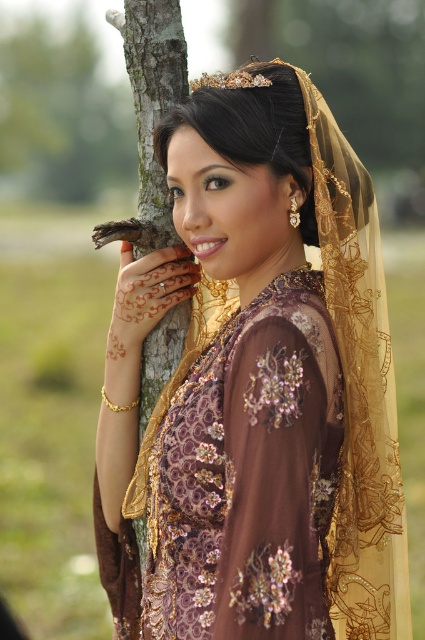
You are a photographer who wants to ensure that both the brown embroidered dress at center and the matte gold headscarf at upper center are clearly visible in your photo. Given their sizes, which object might require you to adjust your camera focus more carefully to ensure it doesn not get lost in the background blur?

The matte gold headscarf at upper center may require more careful focus adjustment because it is smaller in size compared to the brown embroidered dress at center, making it easier to get lost in the background blur.

You are a photographer adjusting the focus on your camera. You have two points in the image you need to focus on, point (115, 616) and point (226, 152). Since the background is blurred, which point should you focus on to ensure it stays sharp?

Point (115, 616) is further to the camera than point (226, 152). Since the background is blurred, focusing on point (115, 616) will keep it sharp as it is closer to the camera, while the farther point might be in the blurred background.

What is located at the coordinates point (257, 385) in the image?

The brown embroidered dress at center is located at point (257, 385).